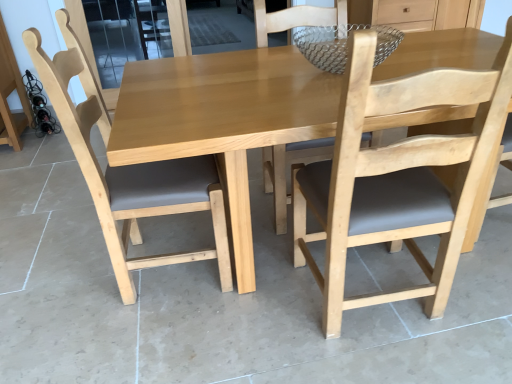
Question: Does black matte wine bottles at left touch light brown wood chair at center, placed as the first chair when sorted from left to right?

Choices:
 (A) yes
 (B) no

Answer: (B)

Question: Can you confirm if black matte wine bottles at left is shorter than light brown wood chair at center, acting as the 2th chair starting from the right?

Choices:
 (A) yes
 (B) no

Answer: (A)

Question: From a real-world perspective, is black matte wine bottles at left located beneath light brown wood chair at center, acting as the 2th chair starting from the right?

Choices:
 (A) yes
 (B) no

Answer: (A)

Question: Is black matte wine bottles at left in front of light brown wood chair at center, placed as the first chair when sorted from left to right?

Choices:
 (A) no
 (B) yes

Answer: (A)

Question: Is light brown wood chair at center, placed as the first chair when sorted from left to right, located within black matte wine bottles at left?

Choices:
 (A) yes
 (B) no

Answer: (B)

Question: Could you tell me if black matte wine bottles at left is turned towards light brown wood chair at center, acting as the 2th chair starting from the right?

Choices:
 (A) yes
 (B) no

Answer: (A)

Question: Is light brown wood chair at center, acting as the 2th chair starting from the right, behind black matte wine bottles at left?

Choices:
 (A) no
 (B) yes

Answer: (A)

Question: Is black matte wine bottles at left inside light brown wood chair at center, placed as the first chair when sorted from left to right?

Choices:
 (A) no
 (B) yes

Answer: (A)

Question: Does light brown wood chair at center, acting as the 2th chair starting from the right, have a larger size compared to black matte wine bottles at left?

Choices:
 (A) yes
 (B) no

Answer: (A)

Question: Does light brown wood chair at center, acting as the 2th chair starting from the right, have a lesser width compared to black matte wine bottles at left?

Choices:
 (A) no
 (B) yes

Answer: (A)

Question: Are light brown wood chair at center, placed as the first chair when sorted from left to right, and black matte wine bottles at left making contact?

Choices:
 (A) yes
 (B) no

Answer: (B)

Question: Is black matte wine bottles at left at the back of light brown wood chair at center, placed as the first chair when sorted from left to right?

Choices:
 (A) yes
 (B) no

Answer: (B)

Question: Is natural wood table at center taller than black matte wine bottles at left?

Choices:
 (A) no
 (B) yes

Answer: (B)